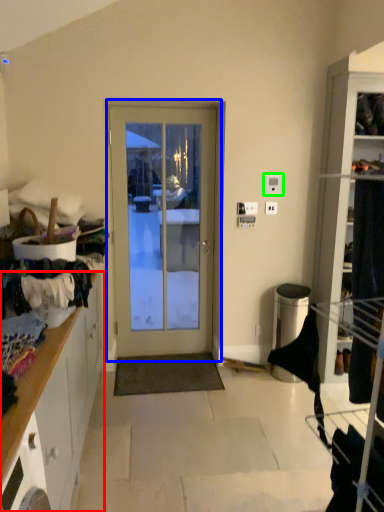
Question: Which object is the closest to the cabinetry (highlighted by a red box)? Choose among these: door (highlighted by a blue box) or light switch (highlighted by a green box).

Choices:
 (A) door
 (B) light switch

Answer: (A)